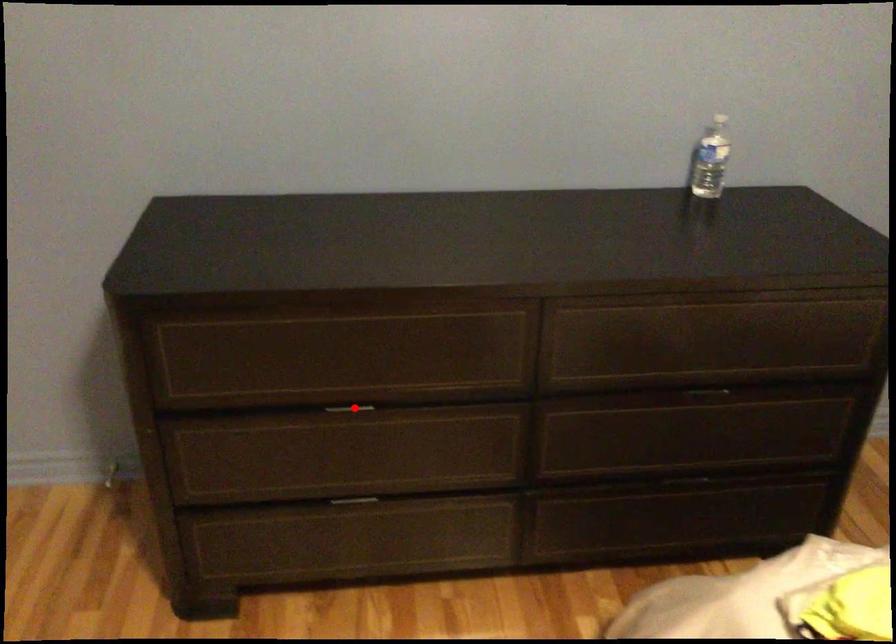
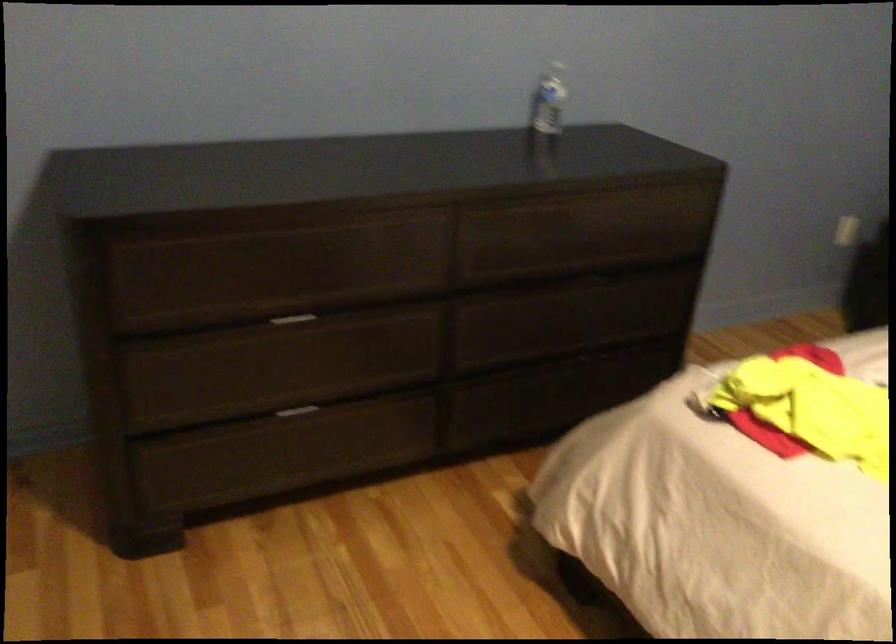
Find the pixel in the second image that matches the highlighted location in the first image.

(291, 319)